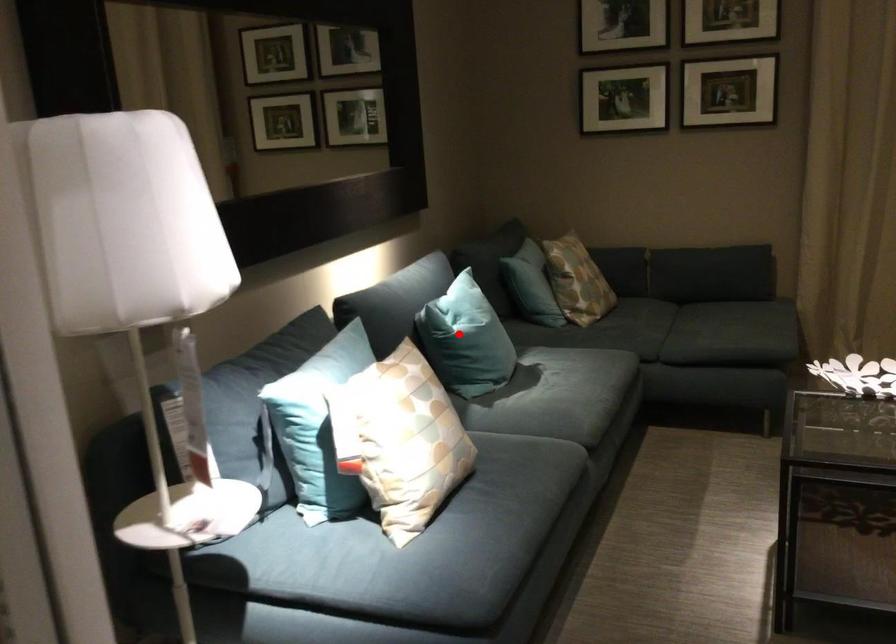
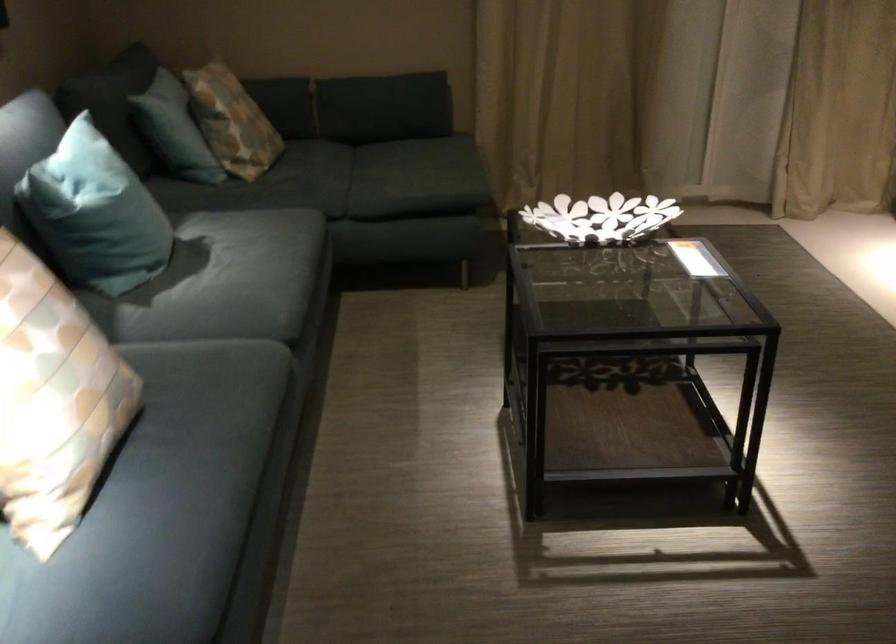
Find the pixel in the second image that matches the highlighted location in the first image.

(95, 214)